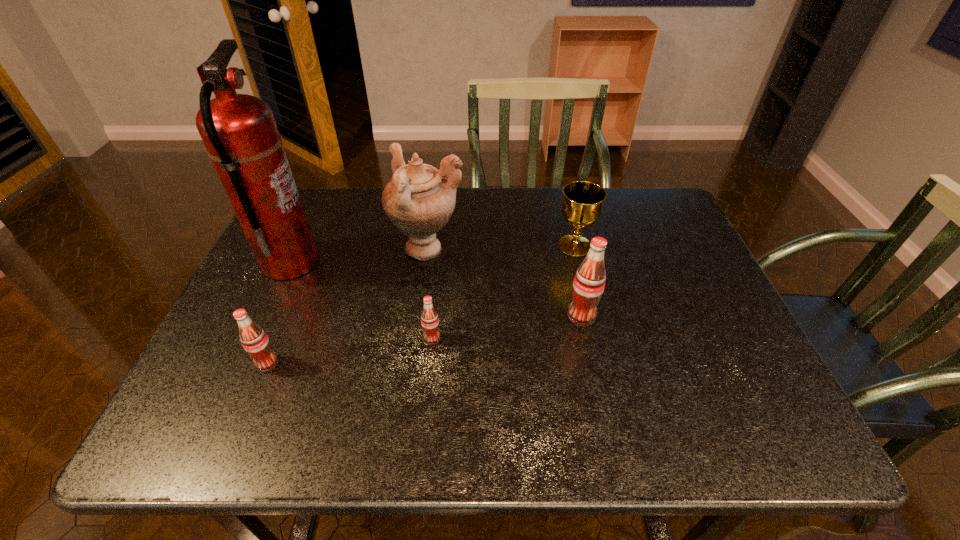
At what (x,y) coordinates should I click in order to perform the action: click on free space between the urn and the chalice. Please return your answer as a coordinate pair (x, y). This screenshot has width=960, height=540. Looking at the image, I should click on (501, 248).

Find the location of a particular element. This screenshot has height=540, width=960. unoccupied position between the chalice and the second soda from right to left is located at coordinates (503, 292).

Where is `free space between the leftmost soda and the second nearest soda`? Image resolution: width=960 pixels, height=540 pixels. free space between the leftmost soda and the second nearest soda is located at coordinates (349, 351).

Identify the location of free spot between the tallest soda and the second farthest soda. (507, 327).

The image size is (960, 540). I want to click on object that is the third closest one to the second farthest soda, so click(254, 340).

Select which object appears as the fifth closest to the fire extinguisher. Please provide its 2D coordinates. Your answer should be formatted as a tuple, i.e. [(x, y)], where the tuple contains the x and y coordinates of a point satisfying the conditions above.

[(583, 200)]

I want to click on the closest soda to the urn, so click(429, 318).

Identify which soda is the nearest to the nearest soda. Please provide its 2D coordinates. Your answer should be formatted as a tuple, i.e. [(x, y)], where the tuple contains the x and y coordinates of a point satisfying the conditions above.

[(429, 318)]

Identify the location of free space that satisfies the following two spatial constraints: 1. on the back side of the shortest soda; 2. on the nozzle side of the fire extinguisher. (440, 263).

Find the location of a particular element. free location that satisfies the following two spatial constraints: 1. on the back side of the nearest object; 2. on the nozzle side of the tallest object is located at coordinates (309, 263).